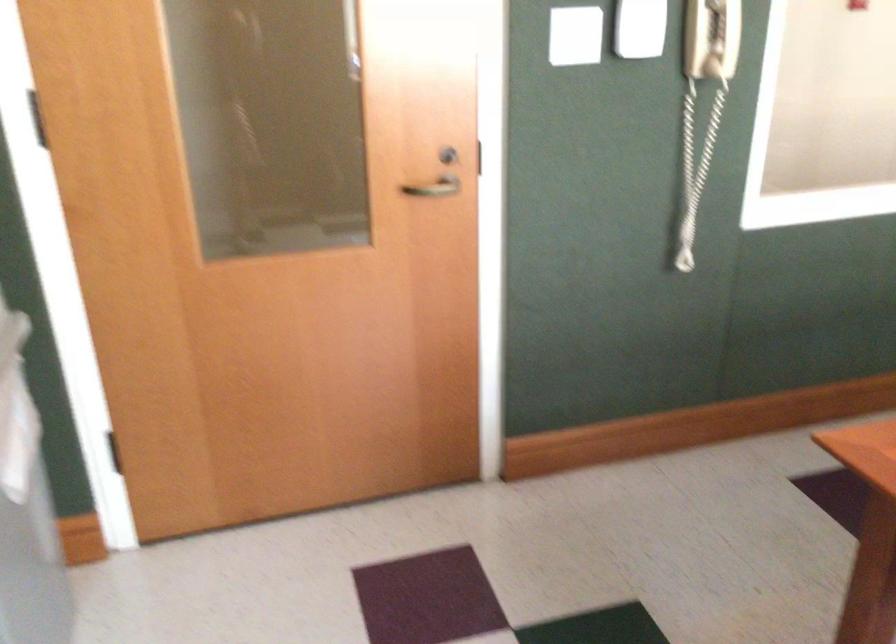
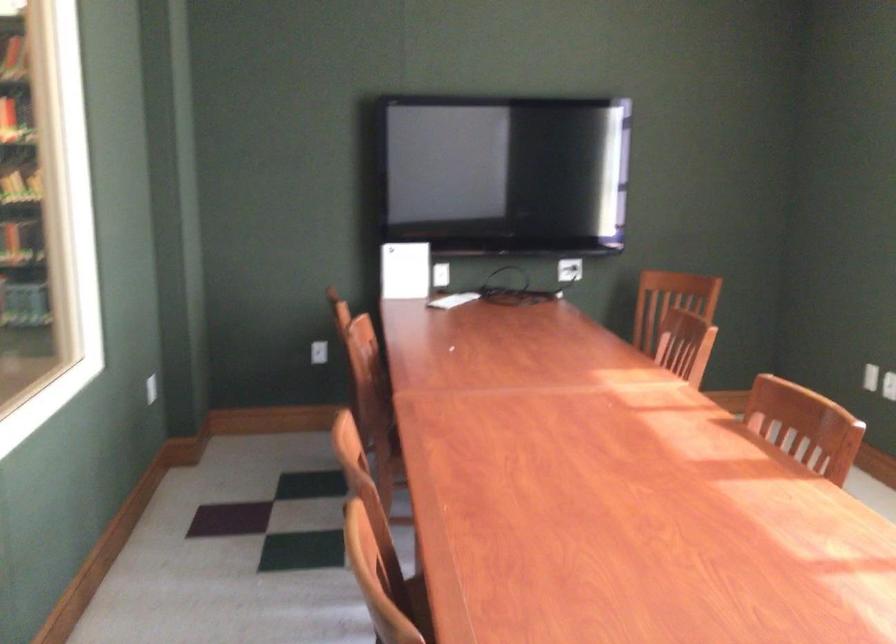
Question: The first image is from the beginning of the video and the second image is from the end. How did the camera likely rotate when shooting the video?

Choices:
 (A) Left
 (B) Right
 (C) Up
 (D) Down

Answer: (B)